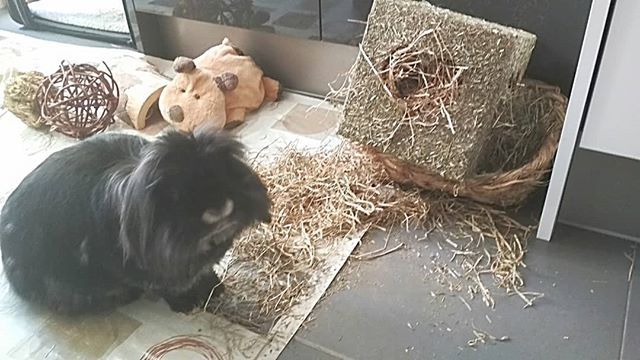
This screenshot has width=640, height=360. I want to click on dark grey baseboard, so click(x=579, y=176), click(x=579, y=199), click(x=637, y=207), click(x=625, y=174), click(x=594, y=161).